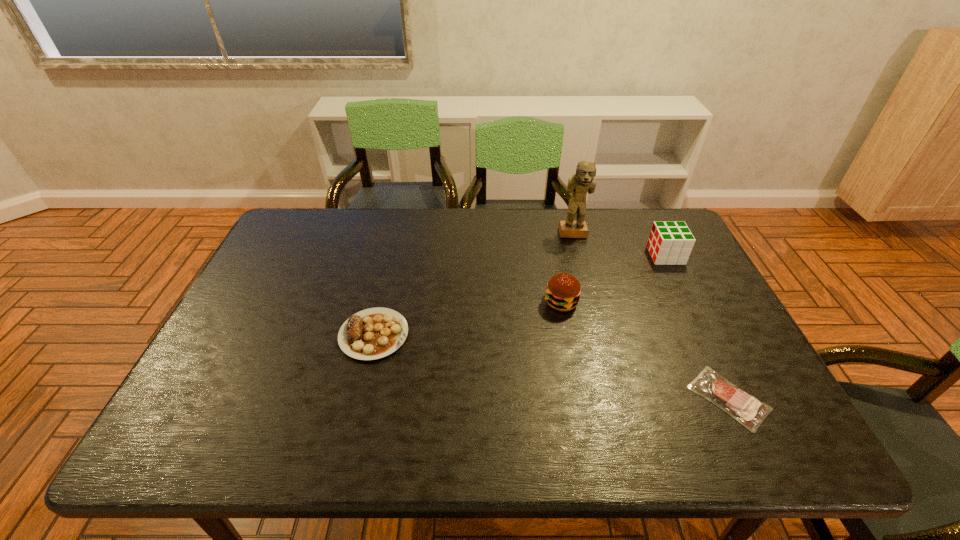
In order to click on the farthest object in this screenshot , I will do `click(583, 181)`.

I want to click on the tallest object, so tap(583, 181).

At what (x,y) coordinates should I click in order to perform the action: click on cube. Please return your answer as a coordinate pair (x, y). Looking at the image, I should click on (670, 243).

The image size is (960, 540). Find the location of `hamburger`. hamburger is located at coordinates (563, 291).

In order to click on the left steak in this screenshot , I will do `click(374, 333)`.

Identify the location of the farther steak. The width and height of the screenshot is (960, 540). (374, 333).

The height and width of the screenshot is (540, 960). I want to click on the nearest object, so pos(748,410).

This screenshot has height=540, width=960. I want to click on the right steak, so click(748, 410).

You are a GUI agent. You are given a task and a screenshot of the screen. Output one action in this format:
    pyautogui.click(x=<x>, y=<y>)
    Task: Click on the vacant space positioned on the front-facing side of the tallest object
    
    Given the screenshot: What is the action you would take?
    pyautogui.click(x=585, y=278)

Locate an element on the screen. The image size is (960, 540). free spot located 0.080m on the red face of the fourth nearest object is located at coordinates (625, 255).